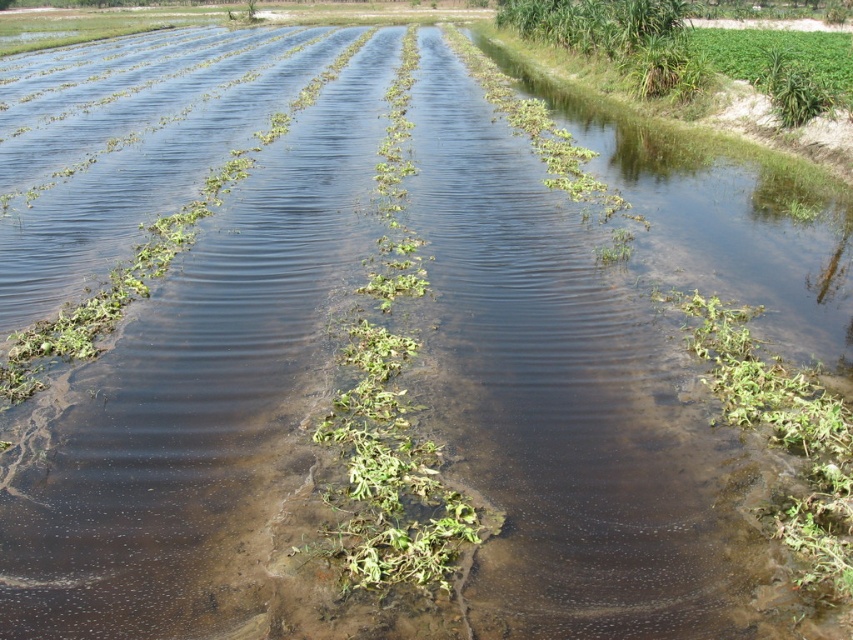
Question: Is green leafy plant at center below green leafy plant at lower right?

Choices:
 (A) no
 (B) yes

Answer: (A)

Question: Can you confirm if green leafy plant at center is positioned to the left of green leafy plant at lower right?

Choices:
 (A) no
 (B) yes

Answer: (B)

Question: Which point is farther to the camera?

Choices:
 (A) green leafy plant at center
 (B) green leafy plant at lower right

Answer: (A)

Question: From the image, what is the correct spatial relationship of green leafy plant at center in relation to green leafy plant at lower right?

Choices:
 (A) below
 (B) above

Answer: (B)